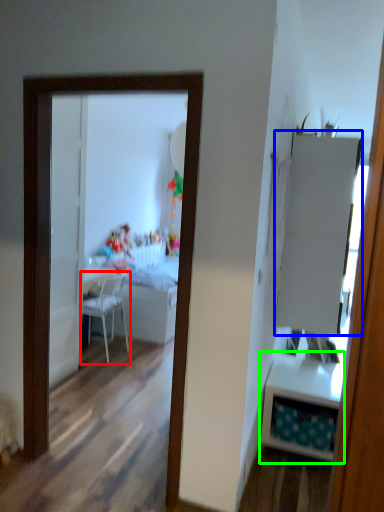
Question: Considering the real-world distances, which object is farthest from chair (highlighted by a red box)? armoire (highlighted by a blue box) or table (highlighted by a green box)?

Choices:
 (A) armoire
 (B) table

Answer: (A)